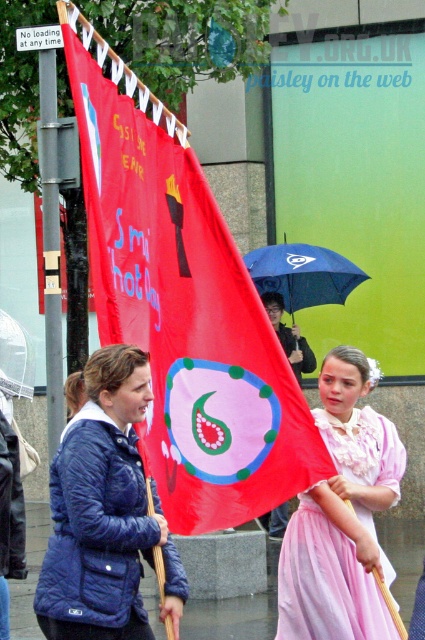
Does red fabric flag at center appear over blue matte umbrella at center?

Actually, red fabric flag at center is below blue matte umbrella at center.

The width and height of the screenshot is (425, 640). What do you see at coordinates (187, 317) in the screenshot?
I see `red fabric flag at center` at bounding box center [187, 317].

At what (x,y) coordinates should I click in order to perform the action: click on red fabric flag at center. Please return your answer as a coordinate pair (x, y). Image resolution: width=425 pixels, height=640 pixels. Looking at the image, I should click on (187, 317).

Between blue matte umbrella at center and transparent plastic umbrella at center, which one is positioned lower?

transparent plastic umbrella at center is below.

Does blue matte umbrella at center have a lesser width compared to transparent plastic umbrella at center?

No, blue matte umbrella at center is not thinner than transparent plastic umbrella at center.

Image resolution: width=425 pixels, height=640 pixels. Find the location of `blue matte umbrella at center`. blue matte umbrella at center is located at coordinates (303, 275).

This screenshot has height=640, width=425. Identify the location of blue matte umbrella at center. (303, 275).

Is navy quilted jacket at center positioned behind pink satin dress at center?

No.

Can you confirm if navy quilted jacket at center is thinner than pink satin dress at center?

No.

Between point (71, 589) and point (320, 547), which one is positioned in front?

Positioned in front is point (71, 589).

The image size is (425, 640). I want to click on navy quilted jacket at center, so click(x=104, y=513).